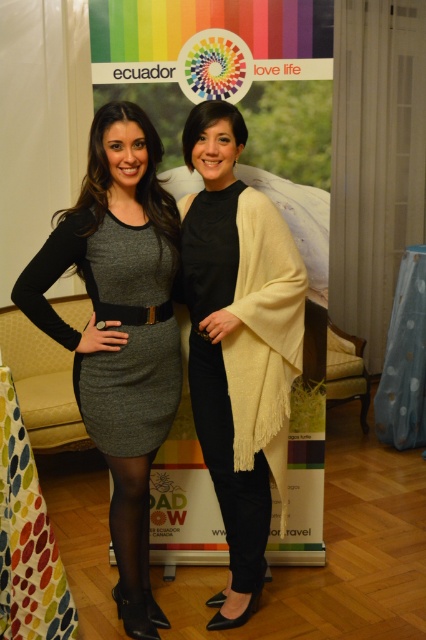
Is point (135, 493) positioned behind point (77, 401)?

No.

Is point (143, 369) closer to camera compared to point (115, 396)?

No.

Identify the location of matte gray dress at center. click(x=120, y=328).

Does matte gray dress at center appear over black denim jeans at center?

Yes.

Can you confirm if matte gray dress at center is positioned to the left of black denim jeans at center?

Correct, you'll find matte gray dress at center to the left of black denim jeans at center.

The height and width of the screenshot is (640, 426). What are the coordinates of `matte gray dress at center` in the screenshot? It's located at 120,328.

The height and width of the screenshot is (640, 426). Find the location of `matte gray dress at center`. matte gray dress at center is located at coordinates pyautogui.click(x=120, y=328).

Is point (146, 348) positioned after point (256, 513)?

No, it is in front of (256, 513).

Who is taller, gray wool dress at center or black denim jeans at center?

black denim jeans at center is taller.

Is point (138, 316) farther from viewer compared to point (224, 497)?

No, it is not.

At what (x,y) coordinates should I click in order to perform the action: click on gray wool dress at center. Please return your answer as a coordinate pair (x, y). Looking at the image, I should click on (129, 339).